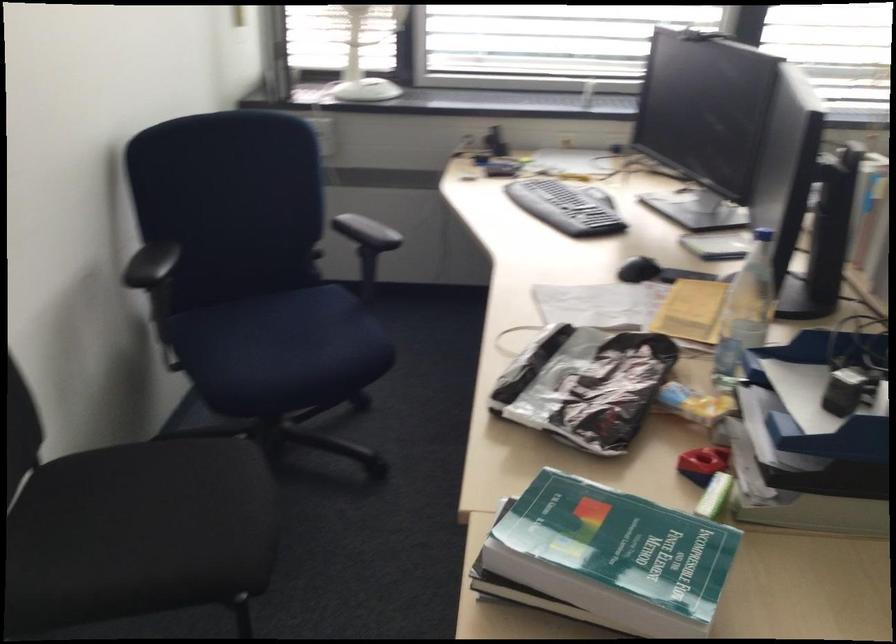
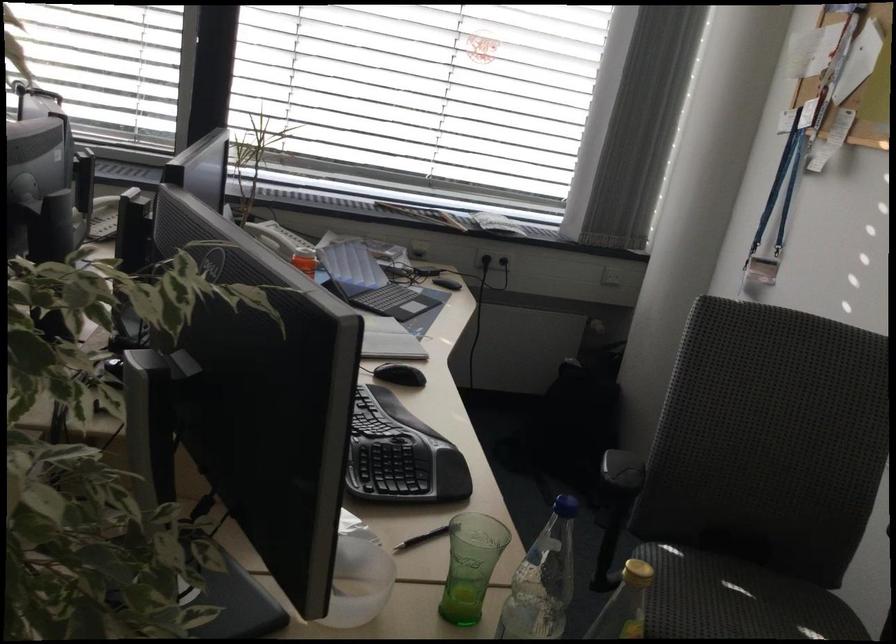
Question: What movement of the cameraman would produce the second image?

Choices:
 (A) Left
 (B) Right
 (C) Forward
 (D) Backward

Answer: (B)